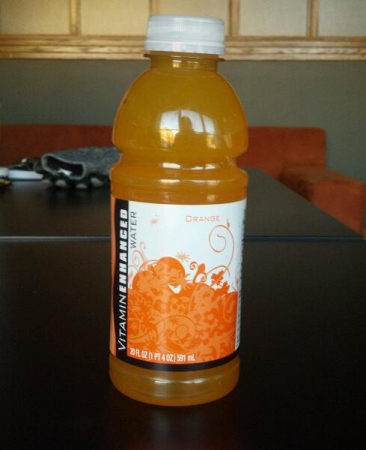
Identify the location of table. (284, 315), (62, 315).